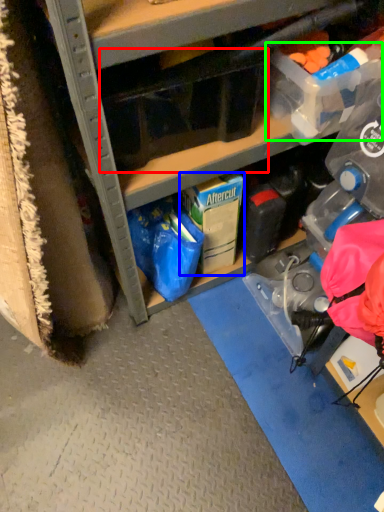
Question: Considering the real-world distances, which object is farthest from storage box (highlighted by a red box)? storage box (highlighted by a blue box) or storage box (highlighted by a green box)?

Choices:
 (A) storage box
 (B) storage box

Answer: (A)